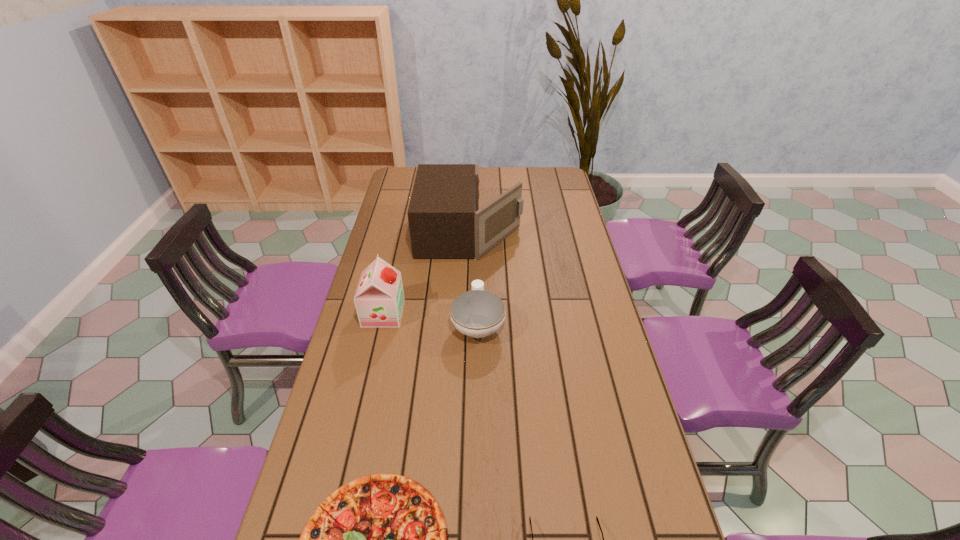
I want to click on the farthest object, so click(x=445, y=221).

This screenshot has height=540, width=960. Find the location of `soya milk`. soya milk is located at coordinates (379, 299).

At what (x,y) coordinates should I click in order to perform the action: click on chinaware. Please return your answer as a coordinate pair (x, y). The width and height of the screenshot is (960, 540). Looking at the image, I should click on (477, 313).

The width and height of the screenshot is (960, 540). Find the location of `free space located with the door open on the front of the farthest object`. free space located with the door open on the front of the farthest object is located at coordinates (559, 232).

The image size is (960, 540). I want to click on blank space located with the cap open on the soya milk, so click(492, 313).

Find the location of `free space located on the side with the handle of the third tallest object`. free space located on the side with the handle of the third tallest object is located at coordinates (478, 257).

The height and width of the screenshot is (540, 960). Find the location of `vacant area located 0.070m on the side with the handle of the third tallest object`. vacant area located 0.070m on the side with the handle of the third tallest object is located at coordinates (478, 286).

Locate an element on the screen. The image size is (960, 540). free space located on the side with the handle of the third tallest object is located at coordinates (478, 254).

Identify the location of object located in the left edge section of the desktop. (379, 299).

Image resolution: width=960 pixels, height=540 pixels. Identify the location of free spot at the left edge of the desktop. (330, 447).